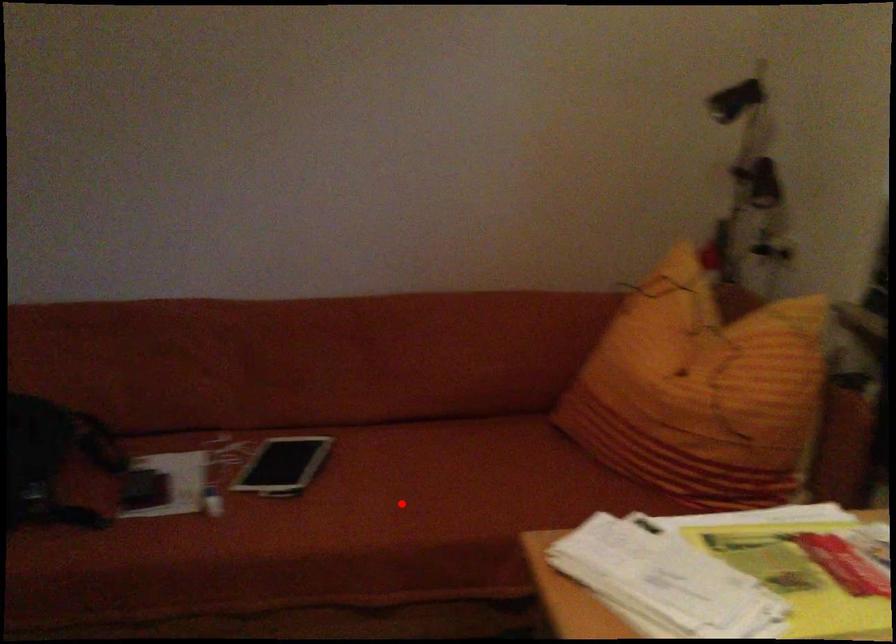
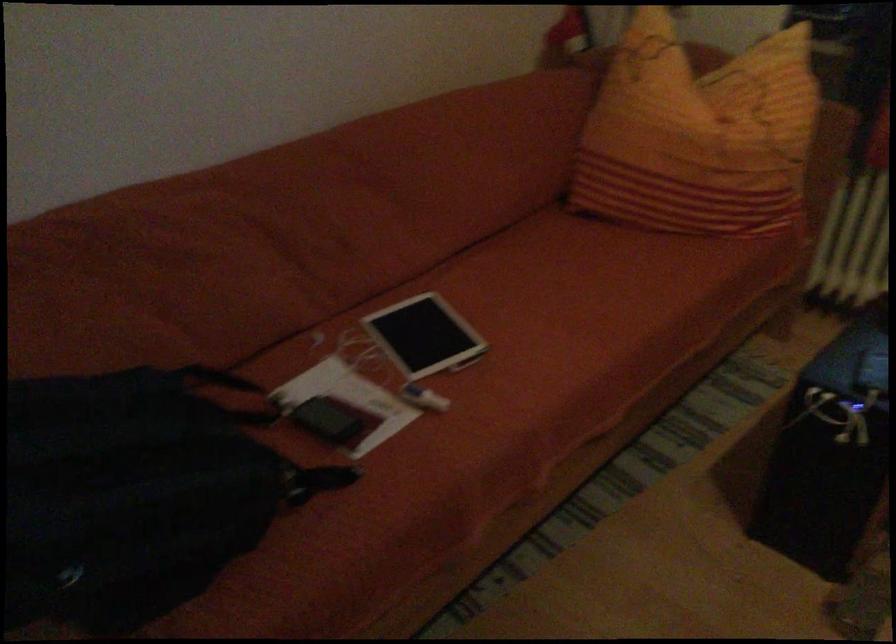
Question: I am providing you with two images of the same scene from different viewpoints. A red point is marked on the first image. At the location where the point appears in image 1, is it still visible in image 2?

Choices:
 (A) Yes
 (B) No

Answer: (A)